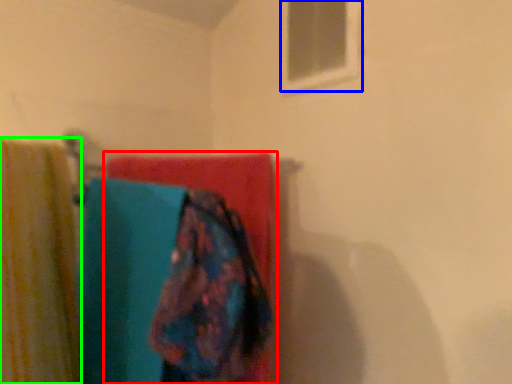
Question: Considering the real-world distances, which object is closest to towel (highlighted by a red box)? window (highlighted by a blue box) or curtain (highlighted by a green box).

Choices:
 (A) window
 (B) curtain

Answer: (B)